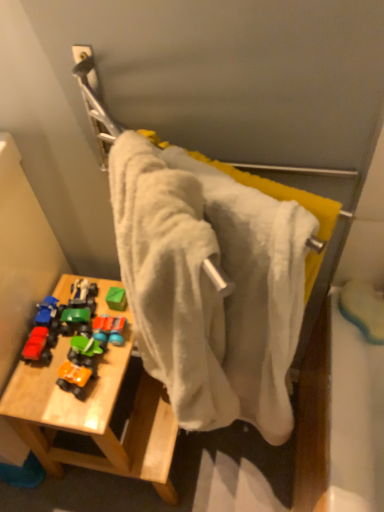
What do you see at coordinates (108, 330) in the screenshot? This screenshot has width=384, height=512. I see `rubberized plastic toy car at center, the 1th toy from the right` at bounding box center [108, 330].

Measure the distance between point (x=103, y=334) and camera.

A distance of 37.17 inches exists between point (x=103, y=334) and camera.

Locate an element on the screen. matte red toy car at left, which appears as the 4th toy when viewed from the right is located at coordinates (37, 345).

This screenshot has width=384, height=512. I want to click on matte blue car at left, which appears as the third toy when viewed from the right, so click(46, 310).

Between matte red toy car at left, which appears as the 4th toy when viewed from the right, and rubberized plastic toy car at center, the fourth toy from the left, which one has larger size?

rubberized plastic toy car at center, the fourth toy from the left.

How different are the orientations of matte red toy car at left, the first toy in the left-to-right sequence, and rubberized plastic toy car at center, the 1th toy from the right, in degrees?

There is a 0.000584-degree angle between the facing directions of matte red toy car at left, the first toy in the left-to-right sequence, and rubberized plastic toy car at center, the 1th toy from the right.

Which object is positioned more to the left, matte red toy car at left, which appears as the 4th toy when viewed from the right, or rubberized plastic toy car at center, the 1th toy from the right?

matte red toy car at left, which appears as the 4th toy when viewed from the right.

From the image's perspective, between matte red toy car at left, the first toy in the left-to-right sequence, and rubberized plastic toy car at center, the 1th toy from the right, who is located below?

matte red toy car at left, the first toy in the left-to-right sequence, from the image's perspective.

From the image's perspective, is rubberized plastic toy car at center, the fourth toy from the left, positioned above or below orange matte toy car at lower left, which is counted as the third toy, starting from the left?

rubberized plastic toy car at center, the fourth toy from the left, is situated higher than orange matte toy car at lower left, which is counted as the third toy, starting from the left, in the image.

Based on the photo, between rubberized plastic toy car at center, the 1th toy from the right, and orange matte toy car at lower left, which is counted as the third toy, starting from the left, which one appears on the right side from the viewer's perspective?

Positioned to the right is rubberized plastic toy car at center, the 1th toy from the right.

Considering the relative sizes of rubberized plastic toy car at center, the 1th toy from the right, and orange matte toy car at lower left, which appears as the 2th toy when viewed from the right, in the image provided, is rubberized plastic toy car at center, the 1th toy from the right, bigger than orange matte toy car at lower left, which appears as the 2th toy when viewed from the right,?

No.

Is orange matte toy car at lower left, which is counted as the third toy, starting from the left, at the back of rubberized plastic toy car at center, the fourth toy from the left?

rubberized plastic toy car at center, the fourth toy from the left, does not have its back to orange matte toy car at lower left, which is counted as the third toy, starting from the left.

Is wooden table at lower left far from rubberized plastic toy car at center, the fourth toy from the left?

Actually, wooden table at lower left and rubberized plastic toy car at center, the fourth toy from the left, are a little close together.

Considering the relative sizes of wooden table at lower left and rubberized plastic toy car at center, the fourth toy from the left, in the image provided, is wooden table at lower left bigger than rubberized plastic toy car at center, the fourth toy from the left,?

Yes.

Which point is more distant from viewer, (76, 452) or (115, 336)?

Point (76, 452)

In terms of height, does wooden table at lower left look taller or shorter compared to rubberized plastic toy car at center, the 1th toy from the right?

wooden table at lower left is taller than rubberized plastic toy car at center, the 1th toy from the right.

Which of these two, rubberized plastic toy car at center, the 1th toy from the right, or matte red toy car at left, the first toy in the left-to-right sequence, is wider?

With larger width is matte red toy car at left, the first toy in the left-to-right sequence.

Would you say rubberized plastic toy car at center, the 1th toy from the right, contains matte red toy car at left, which appears as the 4th toy when viewed from the right?

No, matte red toy car at left, which appears as the 4th toy when viewed from the right, is not surrounded by rubberized plastic toy car at center, the 1th toy from the right.

Considering the relative positions of rubberized plastic toy car at center, the 1th toy from the right, and matte red toy car at left, the first toy in the left-to-right sequence, in the image provided, is rubberized plastic toy car at center, the 1th toy from the right, behind matte red toy car at left, the first toy in the left-to-right sequence,?

Yes, the depth of rubberized plastic toy car at center, the 1th toy from the right, is greater than that of matte red toy car at left, the first toy in the left-to-right sequence.

In the scene shown: How different are the orientations of rubberized plastic toy car at center, the fourth toy from the left, and matte red toy car at left, which appears as the 4th toy when viewed from the right, in degrees?

0.000584 degrees.

Looking at this image, considering the positions of objects orange matte toy car at lower left, which appears as the 2th toy when viewed from the right, and matte red toy car at left, the first toy in the left-to-right sequence, in the image provided, who is more to the left, orange matte toy car at lower left, which appears as the 2th toy when viewed from the right, or matte red toy car at left, the first toy in the left-to-right sequence,?

From the viewer's perspective, matte red toy car at left, the first toy in the left-to-right sequence, appears more on the left side.

Is orange matte toy car at lower left, which appears as the 2th toy when viewed from the right, far away from matte red toy car at left, which appears as the 4th toy when viewed from the right?

No, orange matte toy car at lower left, which appears as the 2th toy when viewed from the right, is not far from matte red toy car at left, which appears as the 4th toy when viewed from the right.

Could you tell me if orange matte toy car at lower left, which is counted as the third toy, starting from the left, is turned towards matte red toy car at left, the first toy in the left-to-right sequence?

No, orange matte toy car at lower left, which is counted as the third toy, starting from the left, is not facing towards matte red toy car at left, the first toy in the left-to-right sequence.

How much distance is there between orange matte toy car at lower left, which appears as the 2th toy when viewed from the right, and matte red toy car at left, which appears as the 4th toy when viewed from the right?

orange matte toy car at lower left, which appears as the 2th toy when viewed from the right, is 3.25 inches away from matte red toy car at left, which appears as the 4th toy when viewed from the right.

From a real-world perspective, is matte blue car at left, placed as the 2th toy when sorted from left to right, on top of white fabric towel at center?

No, from a real-world perspective, matte blue car at left, placed as the 2th toy when sorted from left to right, is not above white fabric towel at center.

Considering the sizes of objects matte blue car at left, placed as the 2th toy when sorted from left to right, and white fabric towel at center in the image provided, who is taller, matte blue car at left, placed as the 2th toy when sorted from left to right, or white fabric towel at center?

With more height is white fabric towel at center.

Do you think matte blue car at left, placed as the 2th toy when sorted from left to right, is within white fabric towel at center, or outside of it?

matte blue car at left, placed as the 2th toy when sorted from left to right, is outside white fabric towel at center.

Could you measure the distance between matte blue car at left, placed as the 2th toy when sorted from left to right, and white fabric towel at center?

A distance of 23.26 inches exists between matte blue car at left, placed as the 2th toy when sorted from left to right, and white fabric towel at center.

Consider the image. Who is smaller, matte blue car at left, placed as the 2th toy when sorted from left to right, or orange matte toy car at lower left, which is counted as the third toy, starting from the left?

With smaller size is matte blue car at left, placed as the 2th toy when sorted from left to right.

Considering the sizes of objects matte blue car at left, which appears as the third toy when viewed from the right, and orange matte toy car at lower left, which appears as the 2th toy when viewed from the right, in the image provided, who is taller, matte blue car at left, which appears as the third toy when viewed from the right, or orange matte toy car at lower left, which appears as the 2th toy when viewed from the right,?

orange matte toy car at lower left, which appears as the 2th toy when viewed from the right.

From the image's perspective, does matte blue car at left, which appears as the third toy when viewed from the right, appear higher than orange matte toy car at lower left, which appears as the 2th toy when viewed from the right?

Indeed, from the image's perspective, matte blue car at left, which appears as the third toy when viewed from the right, is shown above orange matte toy car at lower left, which appears as the 2th toy when viewed from the right.

Which toy is the 1st one when counting from the front of the rubberized plastic toy car at center, the 1th toy from the right? Please provide its 2D coordinates.

[(37, 345)]

Locate an element on the screen. The width and height of the screenshot is (384, 512). toy on the right of orange matte toy car at lower left, which is counted as the third toy, starting from the left is located at coordinates (108, 330).

From the image, which object appears to be farther from white fabric towel at center, matte blue car at left, placed as the 2th toy when sorted from left to right, or orange matte toy car at lower left, which appears as the 2th toy when viewed from the right?

matte blue car at left, placed as the 2th toy when sorted from left to right.

When comparing their distances from orange matte toy car at lower left, which is counted as the third toy, starting from the left, does white fabric towel at center or wooden table at lower left seem closer?

wooden table at lower left lies closer to orange matte toy car at lower left, which is counted as the third toy, starting from the left, than the other object.

Estimate the real-world distances between objects in this image. Which object is further from wooden table at lower left, matte red toy car at left, the first toy in the left-to-right sequence, or orange matte toy car at lower left, which is counted as the third toy, starting from the left?

The object further to wooden table at lower left is matte red toy car at left, the first toy in the left-to-right sequence.

When comparing their distances from matte red toy car at left, the first toy in the left-to-right sequence, does wooden table at lower left or white fabric towel at center seem closer?

wooden table at lower left.

Which object lies nearer to the anchor point white fabric towel at center, matte red toy car at left, which appears as the 4th toy when viewed from the right, or rubberized plastic toy car at center, the fourth toy from the left?

rubberized plastic toy car at center, the fourth toy from the left, lies closer to white fabric towel at center than the other object.

Estimate the real-world distances between objects in this image. Which object is further from matte blue car at left, placed as the 2th toy when sorted from left to right, orange matte toy car at lower left, which is counted as the third toy, starting from the left, or white fabric towel at center?

white fabric towel at center lies further to matte blue car at left, placed as the 2th toy when sorted from left to right, than the other object.

Based on their spatial positions, is rubberized plastic toy car at center, the 1th toy from the right, or orange matte toy car at lower left, which is counted as the third toy, starting from the left, further from wooden table at lower left?

rubberized plastic toy car at center, the 1th toy from the right, is positioned further to the anchor wooden table at lower left.

In the scene shown: Based on their spatial positions, is rubberized plastic toy car at center, the 1th toy from the right, or wooden table at lower left further from orange matte toy car at lower left, which appears as the 2th toy when viewed from the right?

wooden table at lower left is positioned further to the anchor orange matte toy car at lower left, which appears as the 2th toy when viewed from the right.

Where is `toy between white fabric towel at center and matte red toy car at left, which appears as the 4th toy when viewed from the right, in the front-back direction`? The width and height of the screenshot is (384, 512). toy between white fabric towel at center and matte red toy car at left, which appears as the 4th toy when viewed from the right, in the front-back direction is located at coordinates (73, 378).

Where is `furniture between white fabric towel at center and matte blue car at left, which appears as the third toy when viewed from the right, from front to back`? The image size is (384, 512). furniture between white fabric towel at center and matte blue car at left, which appears as the third toy when viewed from the right, from front to back is located at coordinates (95, 414).

This screenshot has width=384, height=512. In order to click on furniture between white fabric towel at center and orange matte toy car at lower left, which appears as the 2th toy when viewed from the right, in the front-back direction in this screenshot , I will do `click(95, 414)`.

At what (x,y) coordinates should I click in order to perform the action: click on toy between matte blue car at left, placed as the 2th toy when sorted from left to right, and rubberized plastic toy car at center, the fourth toy from the left, in the horizontal direction. Please return your answer as a coordinate pair (x, y). Looking at the image, I should click on (73, 378).